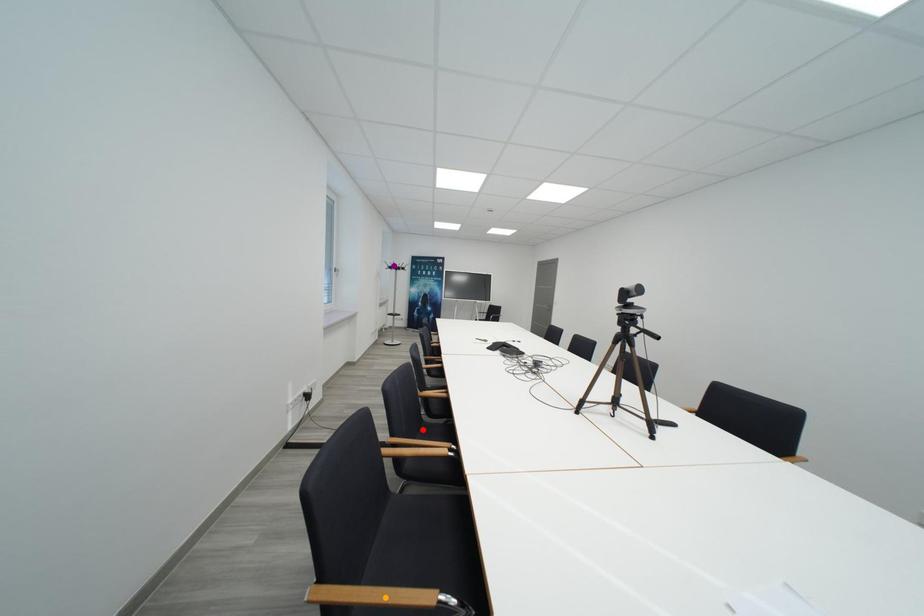
Order these from nearest to farthest:
1. orange point
2. purple point
3. red point

1. orange point
2. red point
3. purple point